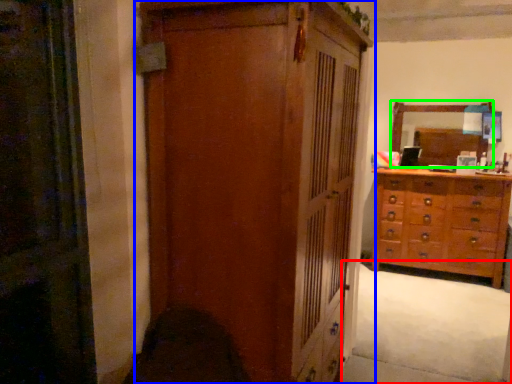
Question: Based on their relative distances, which object is farther from plain (highlighted by a red box)? Choose from cupboard (highlighted by a blue box) and mirror (highlighted by a green box).

Choices:
 (A) cupboard
 (B) mirror

Answer: (A)